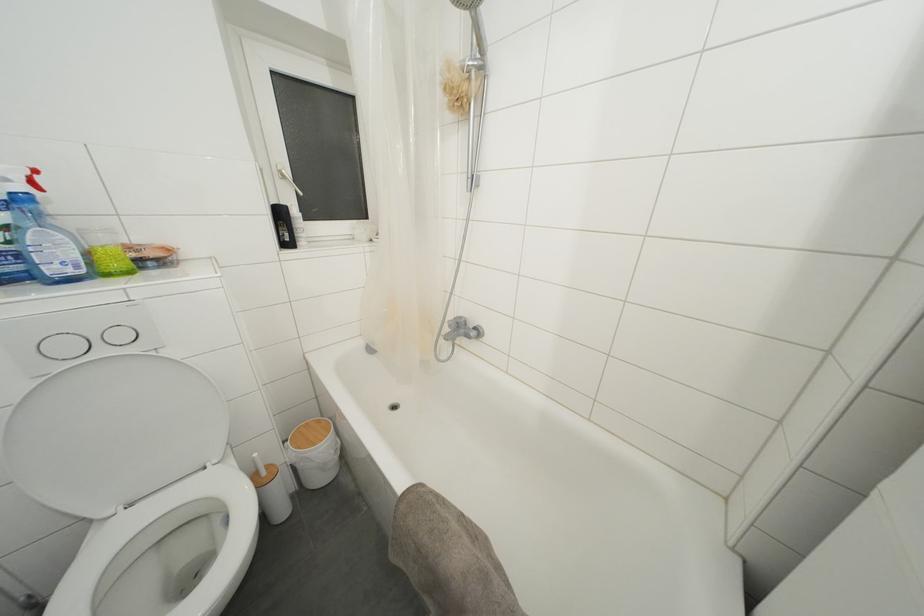
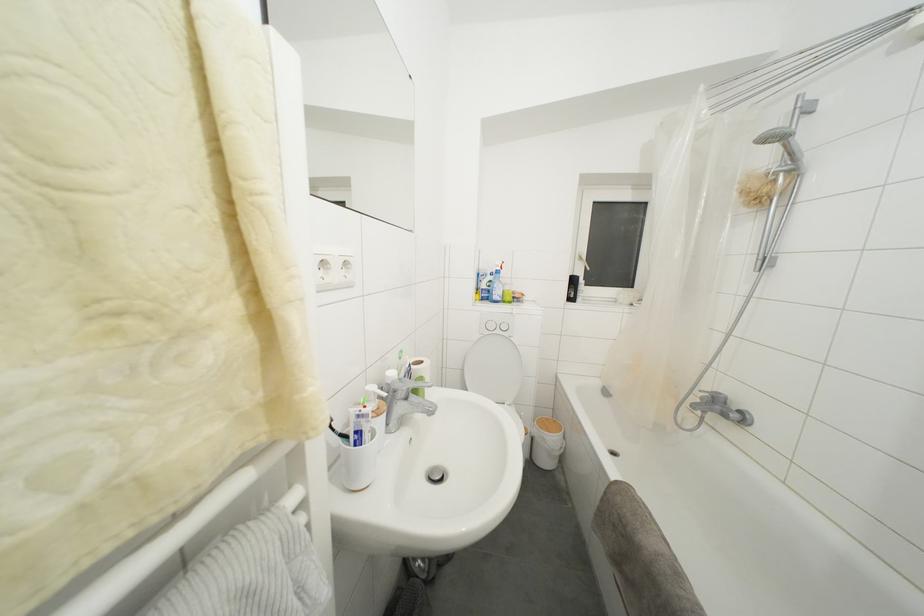
Question: How did the camera likely rotate?

Choices:
 (A) Left
 (B) Right
 (C) Up
 (D) Down

Answer: (A)